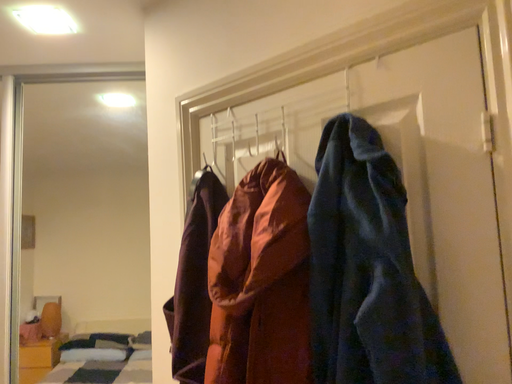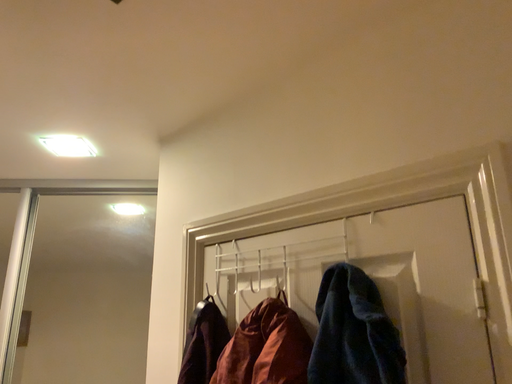
Question: How did the camera likely rotate when shooting the video?

Choices:
 (A) rotated upward
 (B) rotated downward

Answer: (A)